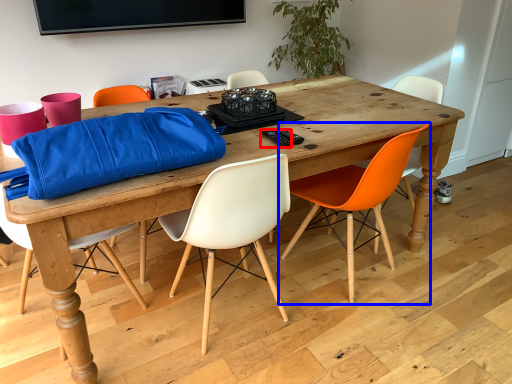
Question: Which object is further to the camera taking this photo, remote control (highlighted by a red box) or chair (highlighted by a blue box)?

Choices:
 (A) remote control
 (B) chair

Answer: (A)